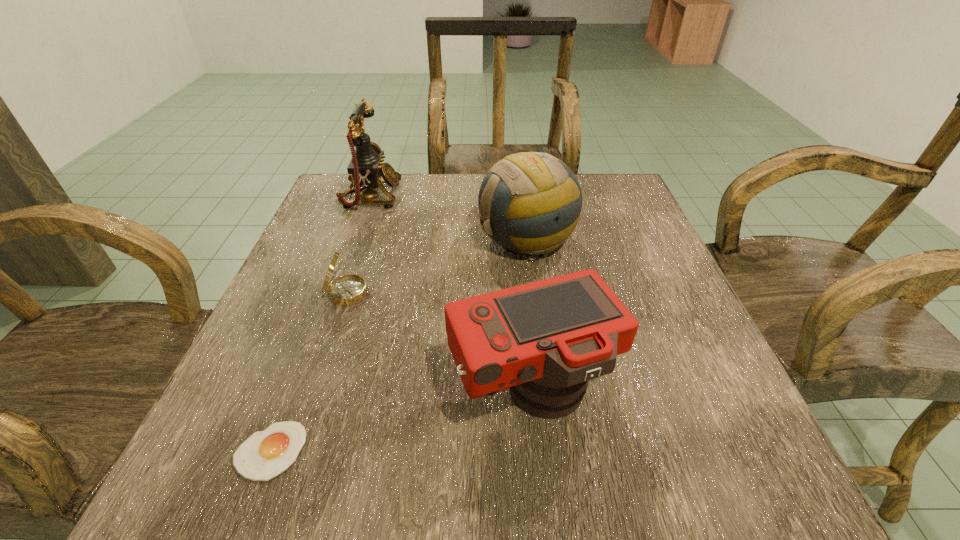
Locate an element on the screen. This screenshot has height=540, width=960. vacant space in between the camera and the shortest object is located at coordinates (400, 421).

Where is `vacant space that is in between the telephone and the camera`? The width and height of the screenshot is (960, 540). vacant space that is in between the telephone and the camera is located at coordinates (451, 293).

Locate an element on the screen. The image size is (960, 540). vacant area that lies between the egg yolk and the camera is located at coordinates (400, 421).

This screenshot has height=540, width=960. Identify the location of empty space between the telephone and the volleyball. (448, 218).

Locate an element on the screen. Image resolution: width=960 pixels, height=540 pixels. vacant area between the shortest object and the telephone is located at coordinates (321, 323).

You are a GUI agent. You are given a task and a screenshot of the screen. Output one action in this format:
    pyautogui.click(x=<x>, y=<y>)
    Task: Click on the vacant area between the telephone and the egg yolk
    This screenshot has width=960, height=540.
    Given the screenshot: What is the action you would take?
    pyautogui.click(x=321, y=323)

In order to click on free space that is in between the telephone and the camera in this screenshot , I will do `click(451, 293)`.

The width and height of the screenshot is (960, 540). Find the location of `the second closest object relative to the camera`. the second closest object relative to the camera is located at coordinates (530, 203).

At what (x,y) coordinates should I click in order to perform the action: click on object that ranks as the fourth closest to the shortest object. Please return your answer as a coordinate pair (x, y). Looking at the image, I should click on (366, 167).

I want to click on free location that satisfies the following two spatial constraints: 1. on the front of the telephone, featuring the rotary dial; 2. on the left side of the volleyball, so click(x=355, y=239).